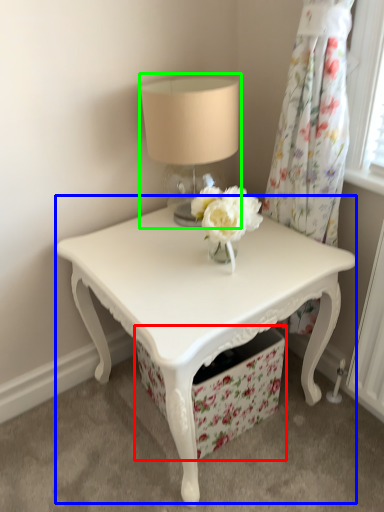
Question: Which object is the farthest from drawer (highlighted by a red box)? Choose among these: table (highlighted by a blue box) or table lamp (highlighted by a green box).

Choices:
 (A) table
 (B) table lamp

Answer: (B)